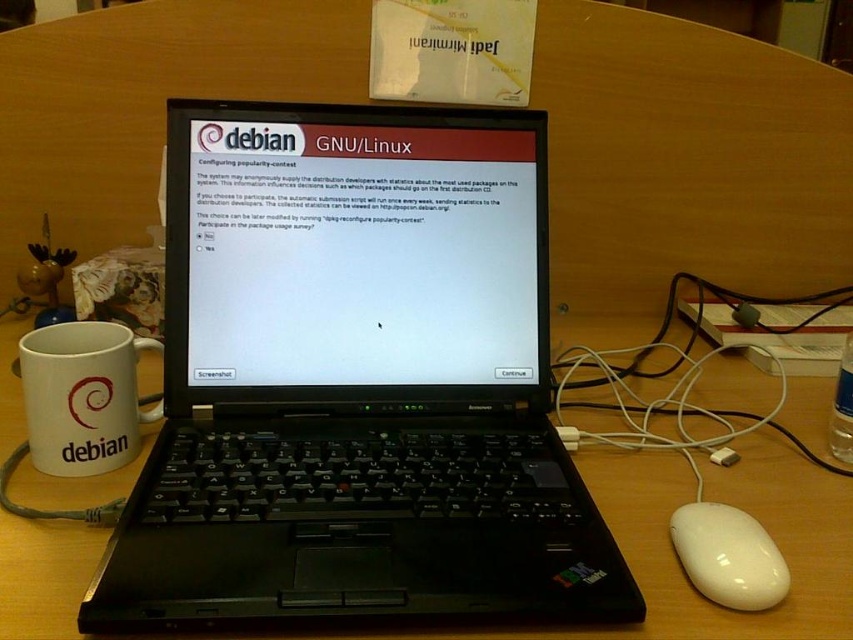
You are organizing a desk and need to place a new keyboard between the black plastic laptop at center and the white glossy mouse at lower right. Considering their sizes, where should the keyboard be placed to ensure it fits properly?

The black plastic laptop at center is much taller than the white glossy mouse at lower right, so the keyboard should be placed between them in a way that accommodates the laptop height, possibly closer to the mouse side to avoid obstruction.